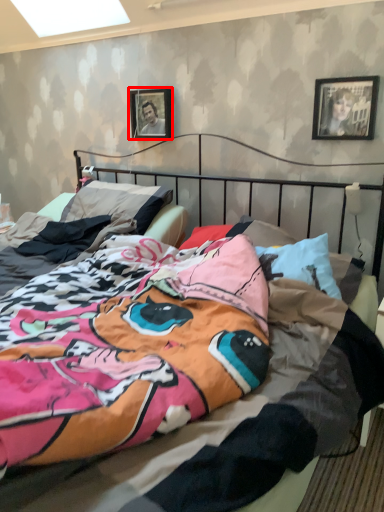
Question: From the image's perspective, what is the correct spatial relationship of picture frame (annotated by the red box) in relation to picture frame?

Choices:
 (A) below
 (B) above

Answer: (B)